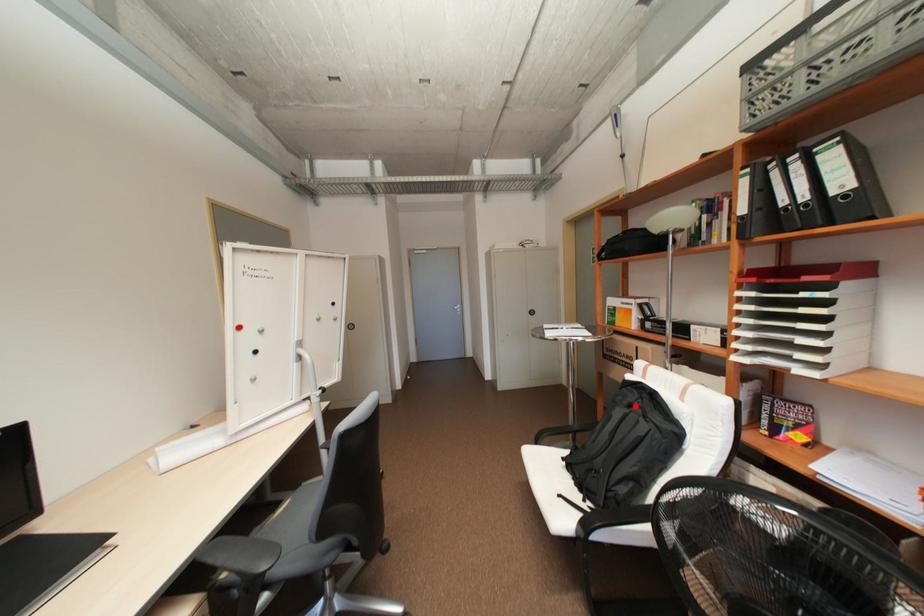
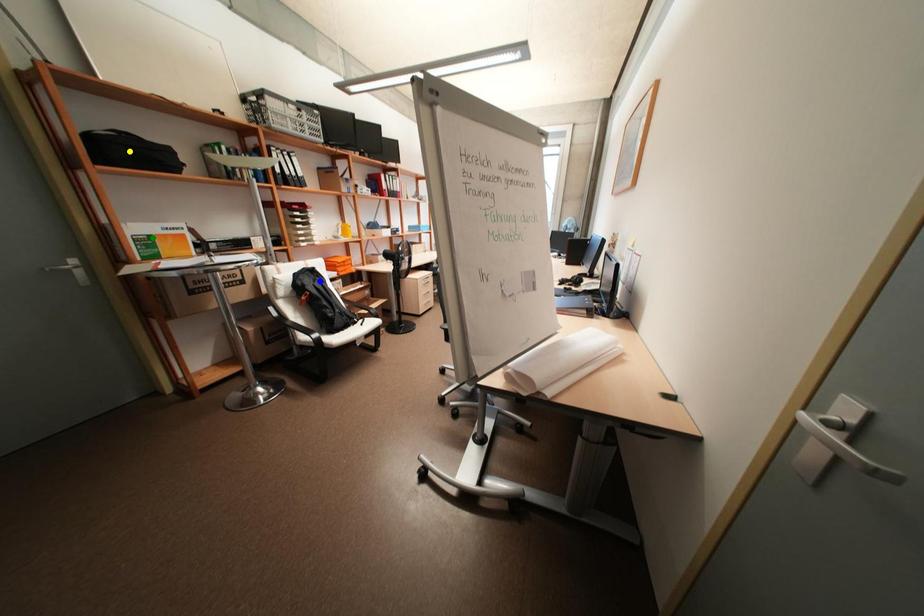
Question: I am providing you with two images of the same scene from different viewpoints. A red point is marked on the first image. You are given multiple points on the second image. Which point in image 2 represents the same 3d spot as the red point in image 1?

Choices:
 (A) yellow point
 (B) green point
 (C) blue point

Answer: (C)